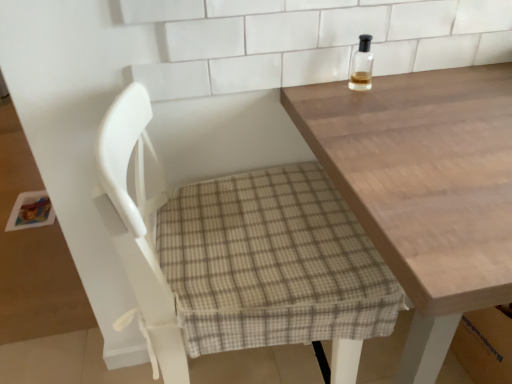
Question: In terms of height, does light brown wooden table at upper right look taller or shorter compared to white fabric chair at center?

Choices:
 (A) tall
 (B) short

Answer: (B)

Question: Looking at their shapes, would you say light brown wooden table at upper right is wider or thinner than white fabric chair at center?

Choices:
 (A) wide
 (B) thin

Answer: (A)

Question: Which is nearer to the light brown wooden table at upper right?

Choices:
 (A) clear glass bottle at upper right
 (B) white fabric chair at center

Answer: (B)

Question: Based on their relative distances, which object is farther from the white fabric chair at center?

Choices:
 (A) light brown wooden table at upper right
 (B) clear glass bottle at upper right

Answer: (B)